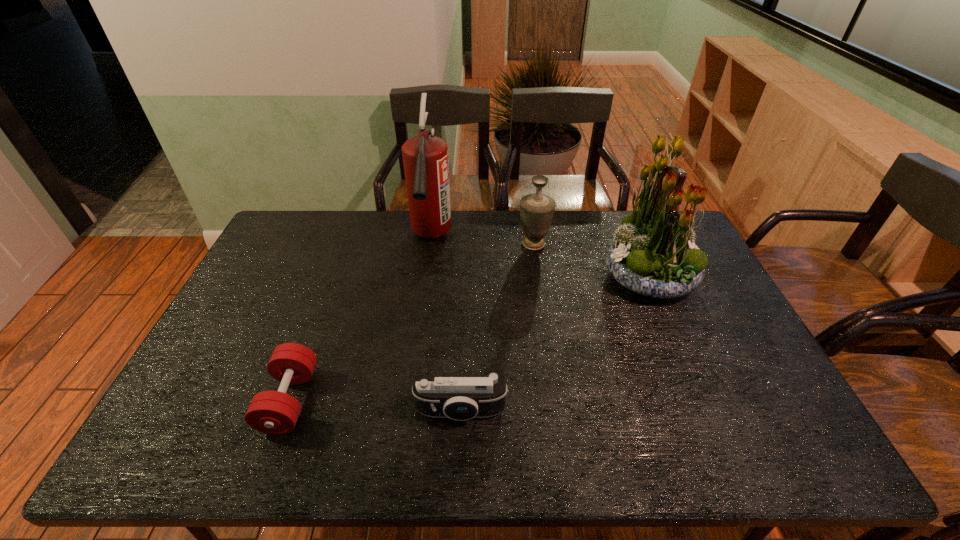
The image size is (960, 540). What are the coordinates of `free spot between the second object from right to left and the rightmost object` in the screenshot? It's located at (591, 261).

The image size is (960, 540). Find the location of `blank region between the leftmost object and the flower arrangement`. blank region between the leftmost object and the flower arrangement is located at coordinates (469, 339).

Where is `free space between the flower arrangement and the leftmost object`? free space between the flower arrangement and the leftmost object is located at coordinates (469, 339).

This screenshot has height=540, width=960. I want to click on empty space that is in between the urn and the dumbbell, so (x=412, y=322).

This screenshot has width=960, height=540. What are the coordinates of `vacant space in between the leftmost object and the fire extinguisher` in the screenshot? It's located at (360, 319).

Identify the location of free space that is in between the rightmost object and the fire extinguisher. Image resolution: width=960 pixels, height=540 pixels. [x=540, y=258].

Identify which object is the third nearest to the fire extinguisher. Please provide its 2D coordinates. Your answer should be formatted as a tuple, i.e. [(x, y)], where the tuple contains the x and y coordinates of a point satisfying the conditions above.

[(460, 397)]

Where is `object that ranks as the closest to the camera`? This screenshot has width=960, height=540. object that ranks as the closest to the camera is located at coordinates (272, 412).

In order to click on free space that satisfies the following two spatial constraints: 1. at the nozzle of the fire extinguisher; 2. on the right side of the second object from right to left in this screenshot , I will do `click(430, 244)`.

What are the coordinates of `vacant space that satisfies the following two spatial constraints: 1. at the nozzle of the fire extinguisher; 2. on the left side of the urn` in the screenshot? It's located at (430, 244).